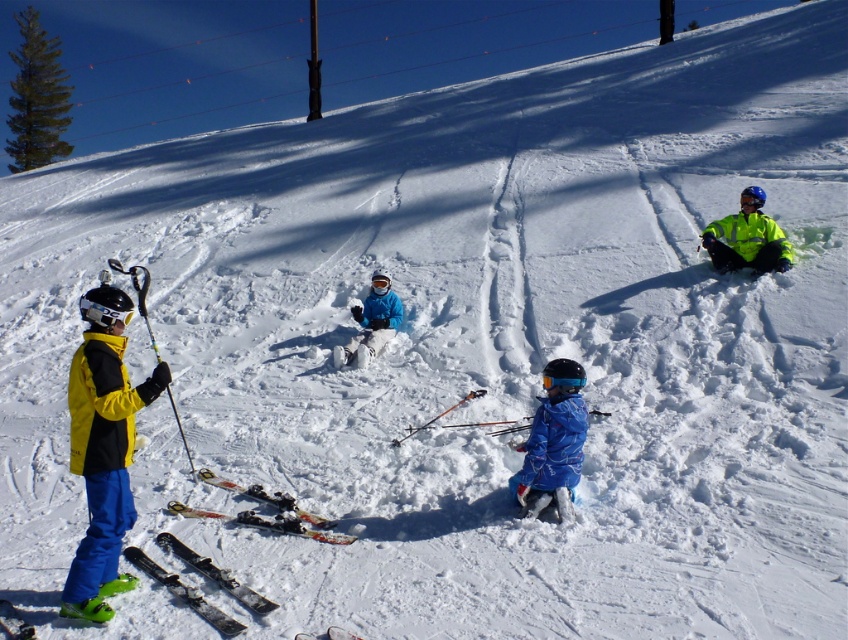
You are standing at the point marked by coordinates point (103, 449) in the snowy scene. Looking around, you see a yellow matte jacket at left. Which direction should you face to see the yellow matte jacket at left?

You should face to the left to see the yellow matte jacket at left since it is located to the left of the point (103, 449).